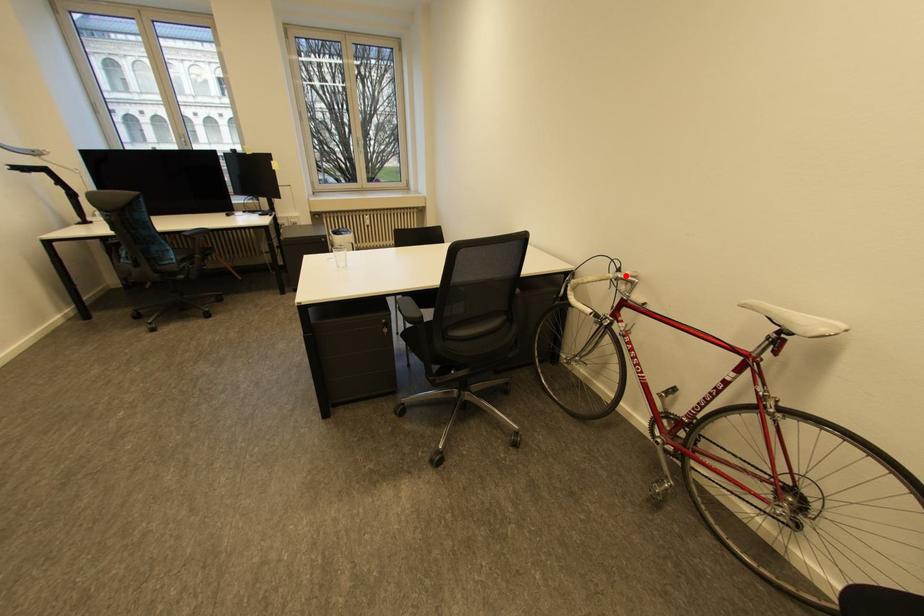
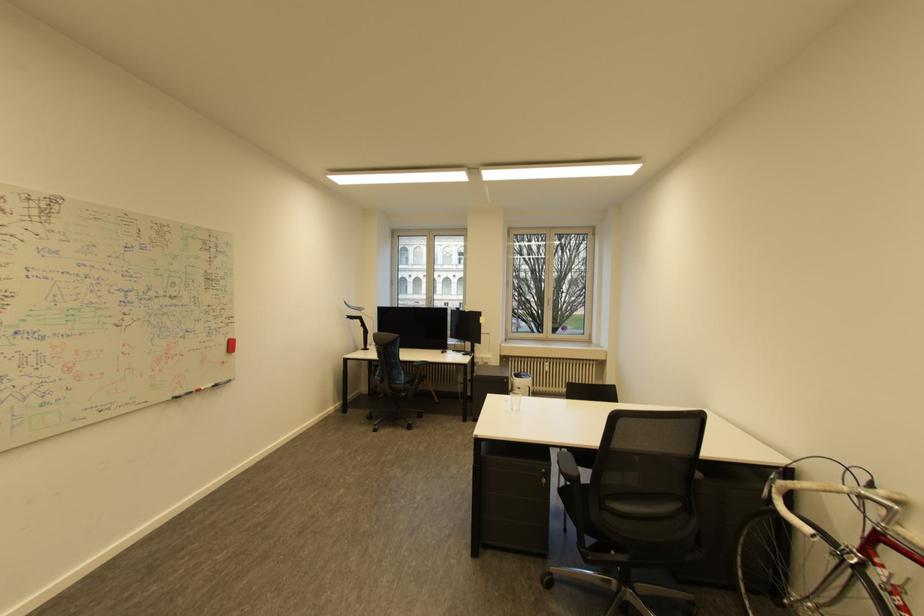
In the second image, find the point that corresponds to the highlighted location in the first image.

(869, 492)